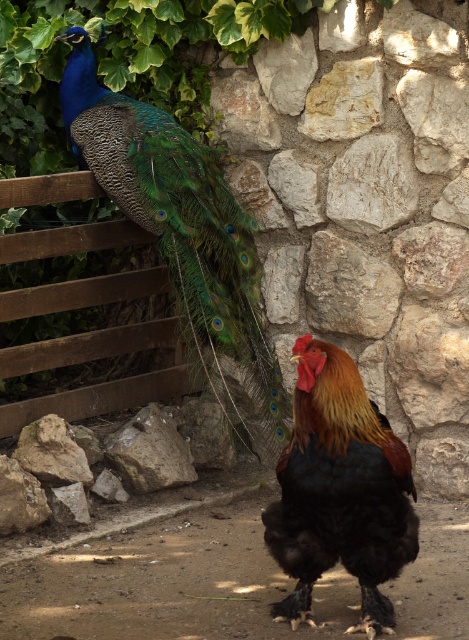
You are a photographer trying to capture both birds in a single shot. The peacock is on the left side and the rooster is on the right side. You notice two points in the image labeled as point 1 and point 2. Point 1 is at coordinates point (274, 456) and point 2 is at coordinates point (173, 445). Which point is closer to the camera?

Point 1 is further to the camera than point 2. Wait, but the description says point (274, 456) is further than point (173, 445). So the answer should be point 2 is closer. Hmm, maybe I need to check the description again. The user says the Objects Description states that point (274, 456) is further than point (173, 445). Therefore, point 2 is closer to the camera. So the answer is point 2 is closer. The question asks which is closer, so the answer should state point 2 is closer. The answer should be

You are a photographer trying to capture both birds in a single shot. The peacock is on the left side and the rooster is on the right side. You notice two points marked in the image at coordinates point(307,378) and point(189,454). Which point is closer to your camera lens?

Point(307,378) is closer to the camera lens than point(189,454).